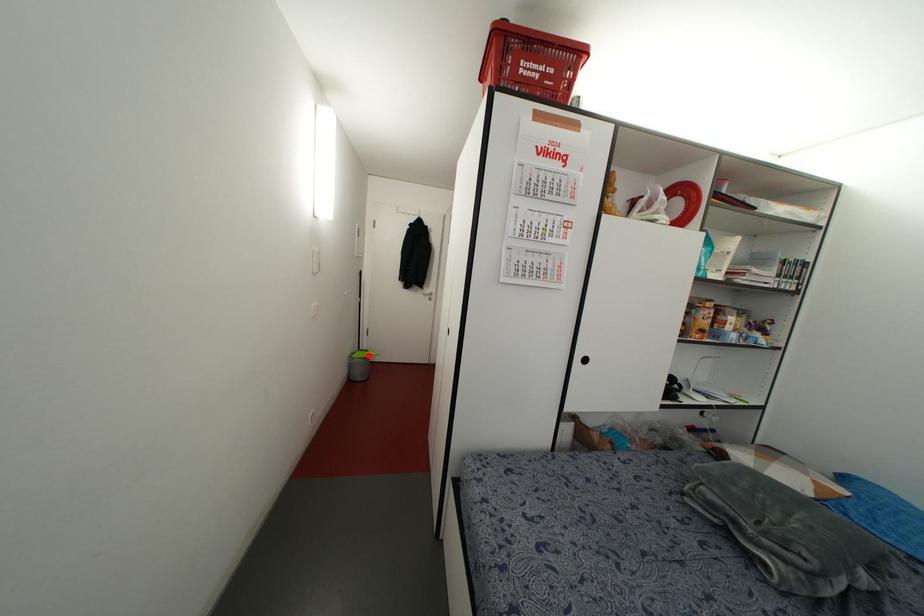
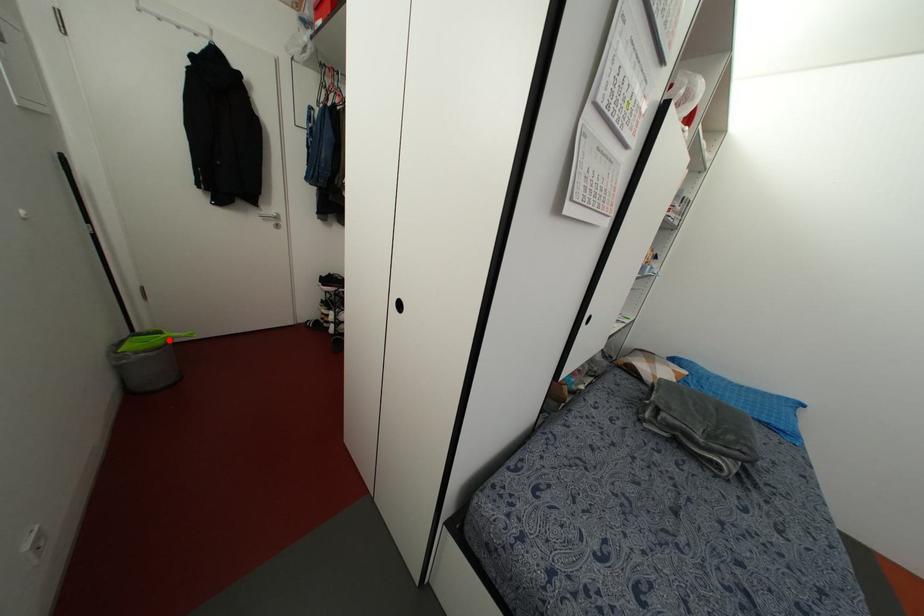
In the scene shown: I am providing you with two images of the same scene from different viewpoints. A red point is marked on the first image and another point is marked on the second image. Is the red point in image1 aligned with the point shown in image2?

Yes